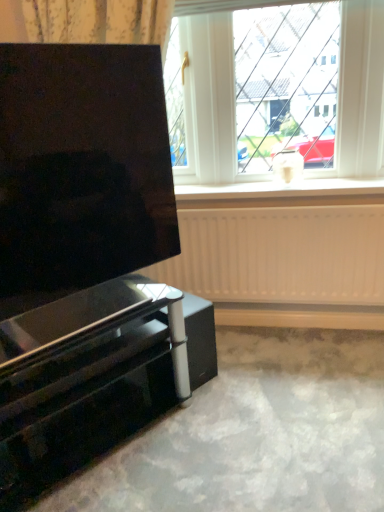
Question: Is white matte window sill at center at the left side of glossy black tv stand at lower left?

Choices:
 (A) yes
 (B) no

Answer: (B)

Question: From a real-world perspective, does white matte window sill at center sit lower than glossy black tv stand at lower left?

Choices:
 (A) yes
 (B) no

Answer: (B)

Question: Is white matte window sill at center not near glossy black tv stand at lower left?

Choices:
 (A) no
 (B) yes

Answer: (A)

Question: From the image's perspective, is white matte window sill at center beneath glossy black tv stand at lower left?

Choices:
 (A) no
 (B) yes

Answer: (A)

Question: Is white matte window sill at center aimed at glossy black tv stand at lower left?

Choices:
 (A) yes
 (B) no

Answer: (B)

Question: Considering the positions of white matte radiator at lower center and matte black screen at left in the image, is white matte radiator at lower center bigger or smaller than matte black screen at left?

Choices:
 (A) big
 (B) small

Answer: (B)

Question: Is white matte radiator at lower center inside the boundaries of matte black screen at left, or outside?

Choices:
 (A) inside
 (B) outside

Answer: (B)

Question: Looking at their shapes, would you say white matte radiator at lower center is wider or thinner than matte black screen at left?

Choices:
 (A) wide
 (B) thin

Answer: (B)

Question: From the image's perspective, relative to matte black screen at left, is white matte radiator at lower center above or below?

Choices:
 (A) above
 (B) below

Answer: (B)

Question: Considering the positions of point tap(41, 202) and point tap(350, 136), is point tap(41, 202) closer or farther from the camera than point tap(350, 136)?

Choices:
 (A) closer
 (B) farther

Answer: (A)

Question: Is matte black screen at left bigger or smaller than white plastic window at upper center?

Choices:
 (A) big
 (B) small

Answer: (A)

Question: From the image's perspective, is matte black screen at left positioned above or below white plastic window at upper center?

Choices:
 (A) above
 (B) below

Answer: (B)

Question: Is matte black screen at left in front of or behind white plastic window at upper center in the image?

Choices:
 (A) front
 (B) behind

Answer: (A)

Question: Does point (369, 180) appear closer or farther from the camera than point (241, 222)?

Choices:
 (A) farther
 (B) closer

Answer: (A)

Question: Do you think white matte window sill at center is within white matte radiator at lower center, or outside of it?

Choices:
 (A) inside
 (B) outside

Answer: (B)